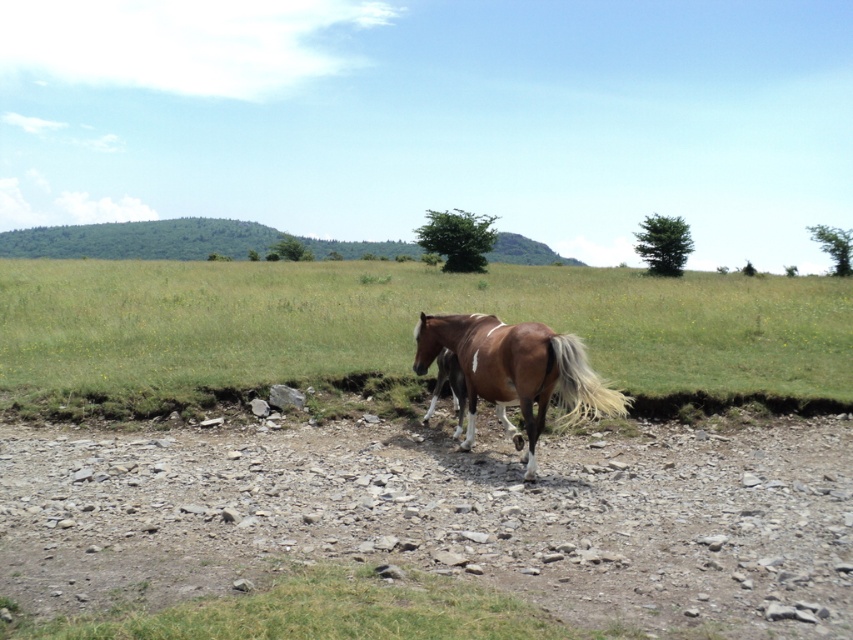
In the scene shown: Can you confirm if brown gravel dirt track at center is wider than brown grass at center?

No, brown gravel dirt track at center is not wider than brown grass at center.

Is point (775, 620) more distant than point (306, 369)?

No, (775, 620) is closer to viewer.

Is point (77, 557) farther from camera compared to point (648, 278)?

No, it is not.

The height and width of the screenshot is (640, 853). I want to click on brown gravel dirt track at center, so click(444, 516).

Who is shorter, brown grass at center or brown glossy horse at center?

Standing shorter between the two is brown glossy horse at center.

Is brown grass at center positioned at the back of brown glossy horse at center?

That is True.

Is point (689, 364) closer to viewer compared to point (496, 326)?

No, it is not.

Find the location of a particular element. Image resolution: width=853 pixels, height=640 pixels. brown grass at center is located at coordinates (399, 330).

Who is lower down, brown gravel dirt track at center or brown glossy horse at center?

Positioned lower is brown gravel dirt track at center.

Who is more distant from viewer, (386,432) or (489,380)?

The point (386,432) is more distant.

This screenshot has height=640, width=853. What are the coordinates of `brown gravel dirt track at center` in the screenshot? It's located at (444, 516).